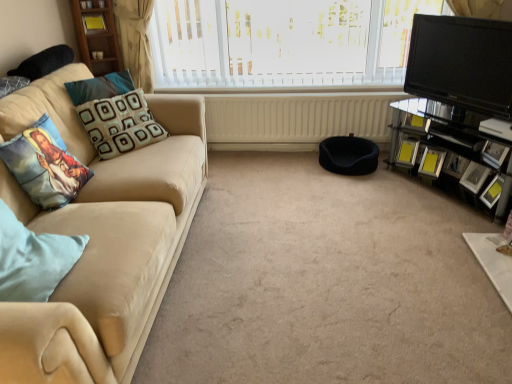
Locate an element on the screen. The height and width of the screenshot is (384, 512). vacant space in front of black glossy entertainment center at right is located at coordinates click(x=447, y=230).